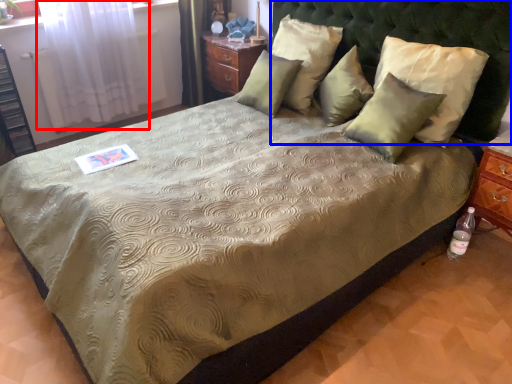
Question: Among these objects, which one is farthest to the camera, curtain (highlighted by a red box) or headboard (highlighted by a blue box)?

Choices:
 (A) curtain
 (B) headboard

Answer: (A)